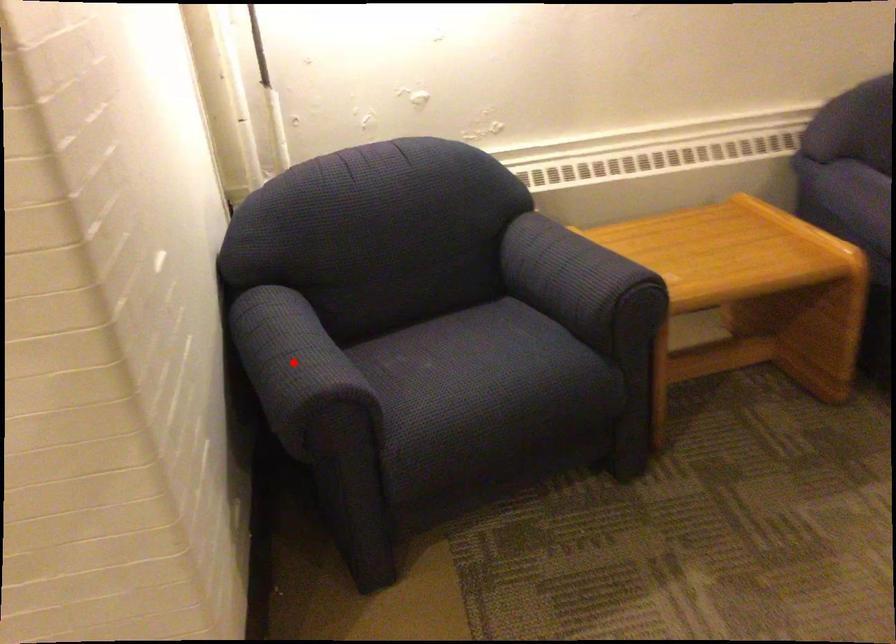
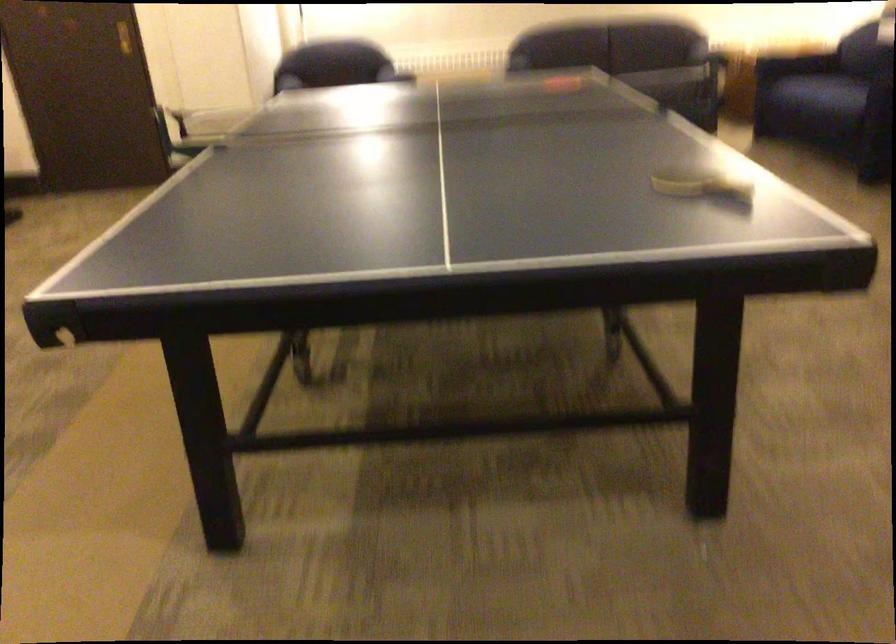
Question: I am providing you with two images of the same scene from different viewpoints. A red point is marked on the first image. Is the red point's position out of view in image 2?

Choices:
 (A) Yes
 (B) No

Answer: (A)